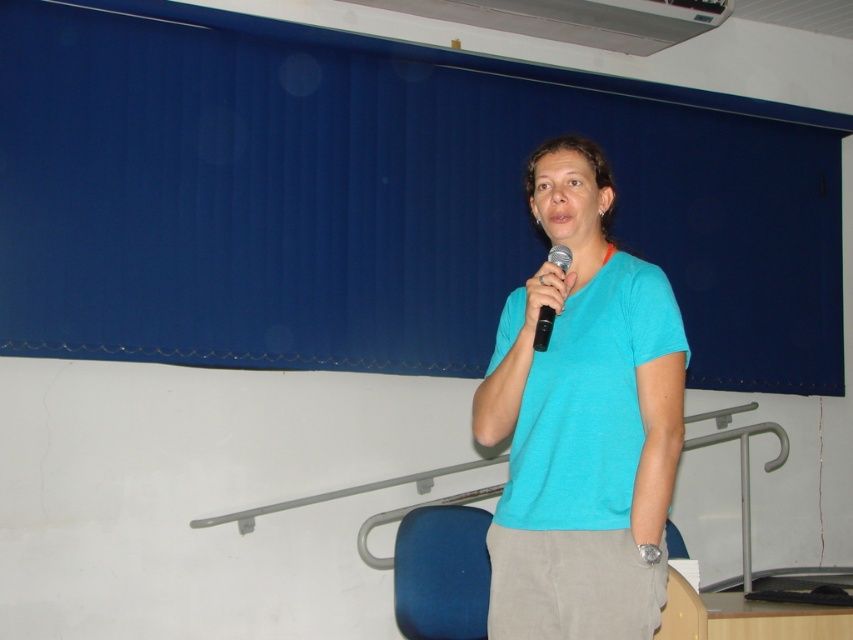
Between matte blue shirt at center and black plastic microphone at center, which one is positioned lower?

Positioned lower is matte blue shirt at center.

Does matte blue shirt at center appear under black plastic microphone at center?

Yes.

Locate an element on the screen. matte blue shirt at center is located at coordinates (582, 420).